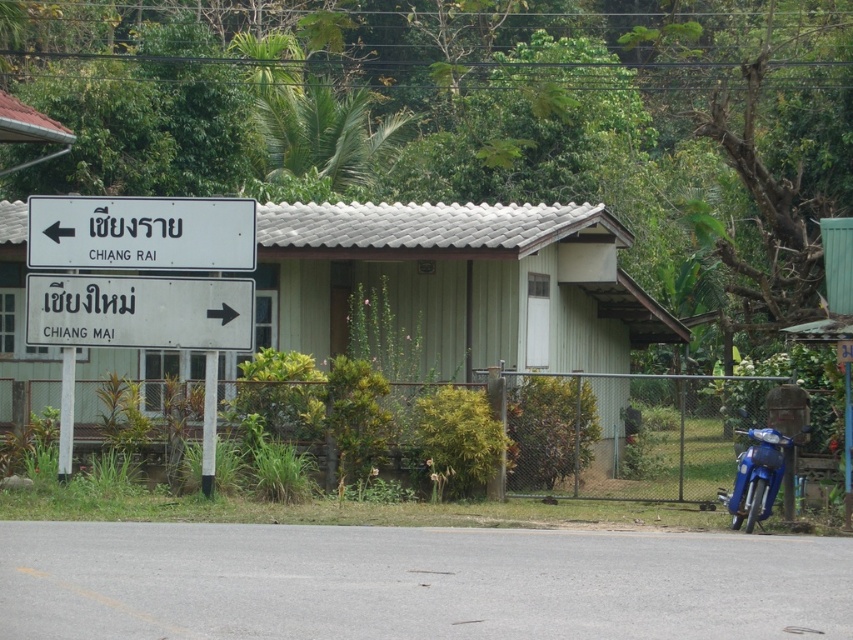
Can you confirm if white plastic sign at left is positioned below white plastic pole at left?

Actually, white plastic sign at left is above white plastic pole at left.

Between white plastic sign at left and white plastic pole at left, which one has more height?

With more height is white plastic pole at left.

The height and width of the screenshot is (640, 853). I want to click on white plastic sign at left, so coord(140,234).

Which is below, white matte sign at center or white plastic pole at lower center?

Positioned lower is white plastic pole at lower center.

Does white matte sign at center appear on the left side of white plastic pole at lower center?

Yes, white matte sign at center is to the left of white plastic pole at lower center.

Measure the distance between point (230, 284) and camera.

Point (230, 284) is 17.06 meters from camera.

Find the location of a particular element. white matte sign at center is located at coordinates (138, 310).

Is white plastic sign at left smaller than white matte sign at center?

No.

Which is more to the right, white plastic sign at left or white matte sign at center?

white plastic sign at left

Does point (228, 250) lie behind point (233, 337)?

That is False.

Where is `white plastic sign at left`? white plastic sign at left is located at coordinates (140, 234).